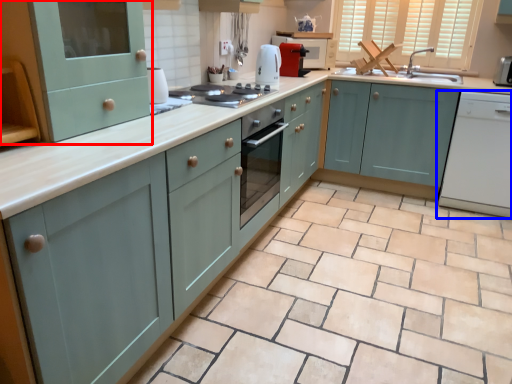
Question: Which object appears closest to the camera in this image, cabinetry (highlighted by a red box) or home appliance (highlighted by a blue box)?

Choices:
 (A) cabinetry
 (B) home appliance

Answer: (A)